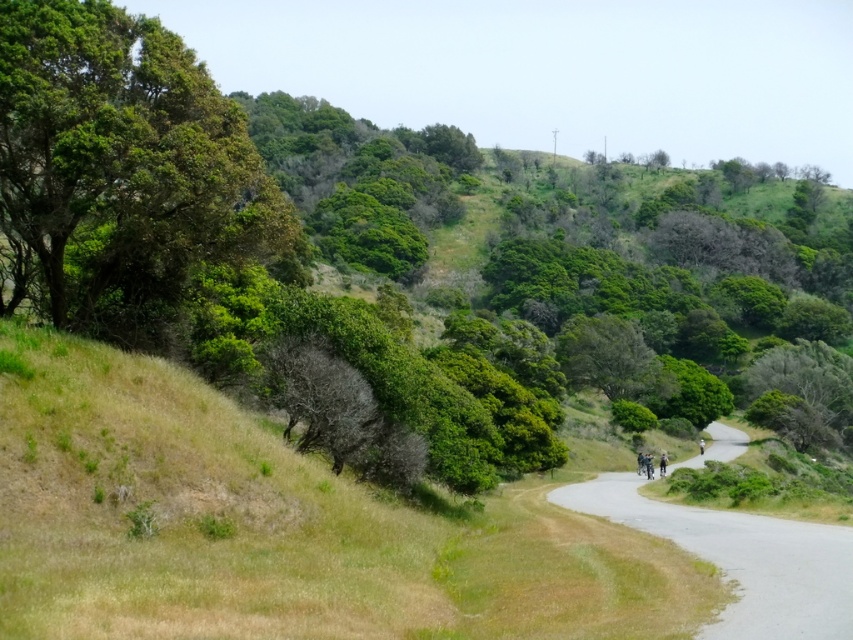
Question: Is green leafy tree at left thinner than gray asphalt road at center?

Choices:
 (A) no
 (B) yes

Answer: (B)

Question: Which of the following is the farthest from the observer?

Choices:
 (A) green leafy tree at left
 (B) gray asphalt road at center

Answer: (A)

Question: Is green leafy tree at left positioned before gray asphalt road at center?

Choices:
 (A) no
 (B) yes

Answer: (A)

Question: Among these objects, which one is farthest from the camera?

Choices:
 (A) gray asphalt road at center
 (B) green leafy tree at left

Answer: (B)

Question: Can you confirm if green leafy tree at left is positioned below gray asphalt road at center?

Choices:
 (A) yes
 (B) no

Answer: (B)